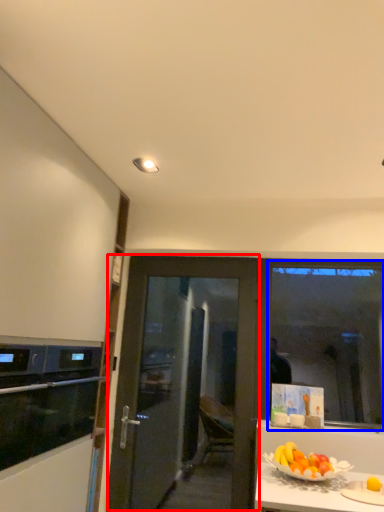
Question: Which of the following is the closest to the observer, door (highlighted by a red box) or window screen (highlighted by a blue box)?

Choices:
 (A) door
 (B) window screen

Answer: (A)